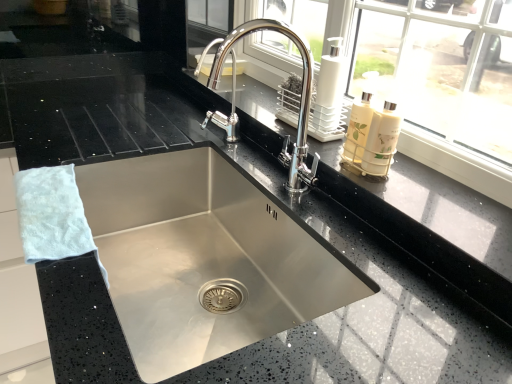
Find the location of a particular element. The height and width of the screenshot is (384, 512). white fluffy hand towel at left is located at coordinates (53, 216).

At what (x,y) coordinates should I click in order to perform the action: click on stainless steel sink at center. Please return your answer as a coordinate pair (x, y). This screenshot has width=512, height=384. Looking at the image, I should click on (206, 258).

Find the location of `white fluffy hand towel at left`. white fluffy hand towel at left is located at coordinates (53, 216).

Does point (307, 117) come closer to viewer compared to point (345, 151)?

No, it is not.

Is polished chrome faucet at center closer to the viewer compared to white glossy soap dispenser at upper right?

Yes, the depth of polished chrome faucet at center is less than that of white glossy soap dispenser at upper right.

From a real-world perspective, relative to white glossy soap dispenser at upper right, is polished chrome faucet at center vertically above or below?

polished chrome faucet at center is below white glossy soap dispenser at upper right.

Can you tell me how much polished chrome faucet at center and white glossy soap dispenser at upper right differ in facing direction?

The facing directions of polished chrome faucet at center and white glossy soap dispenser at upper right are 2.19 degrees apart.

Consider the image. Considering the sizes of objects polished chrome faucet at center and white fluffy hand towel at left in the image provided, who is taller, polished chrome faucet at center or white fluffy hand towel at left?

polished chrome faucet at center.

Is polished chrome faucet at center facing towards white fluffy hand towel at left?

Yes.

The height and width of the screenshot is (384, 512). I want to click on hand towel to the left of polished chrome faucet at center, so click(x=53, y=216).

Are polished chrome faucet at center and white fluffy hand towel at left far apart?

Actually, polished chrome faucet at center and white fluffy hand towel at left are a little close together.

From a real-world perspective, which is physically above, white glossy soap dispenser at upper right or polished chrome faucet at center?

white glossy soap dispenser at upper right is physically above.

Is white glossy soap dispenser at upper right turned away from polished chrome faucet at center?

No, polished chrome faucet at center is not at the back of white glossy soap dispenser at upper right.

Is point (361, 141) closer to viewer compared to point (216, 57)?

Yes, point (361, 141) is closer to viewer.

How many degrees apart are the facing directions of white glossy soap dispenser at upper right and polished chrome faucet at center?

2.19 degrees.

Which is in front, point (122, 272) or point (361, 114)?

The point (361, 114) is more forward.

Who is bigger, stainless steel sink at center or white glossy soap dispenser at upper right?

stainless steel sink at center is bigger.

Consider the image. Is white glossy soap dispenser at upper right completely or partially inside stainless steel sink at center?

No.

Can you confirm if stainless steel sink at center is taller than white glossy soap dispenser at upper right?

Indeed, stainless steel sink at center has a greater height compared to white glossy soap dispenser at upper right.

Considering their positions, is white fluffy hand towel at left located in front of or behind stainless steel sink at center?

white fluffy hand towel at left is behind stainless steel sink at center.

From the image's perspective, which is below, white fluffy hand towel at left or stainless steel sink at center?

stainless steel sink at center appears lower in the image.

Could you tell me if white fluffy hand towel at left is facing stainless steel sink at center?

Yes, white fluffy hand towel at left faces towards stainless steel sink at center.

This screenshot has height=384, width=512. Identify the location of sink lying below the white fluffy hand towel at left (from the image's perspective). (206, 258).

From a real-world perspective, does polished chrome faucet at center sit lower than stainless steel sink at center?

No.

How many degrees apart are the facing directions of polished chrome faucet at center and stainless steel sink at center?

They differ by 1.29 degrees in their facing directions.

Would you consider polished chrome faucet at center to be distant from stainless steel sink at center?

They are positioned close to each other.

Where is `sink on the left of the polished chrome faucet at center`? Image resolution: width=512 pixels, height=384 pixels. sink on the left of the polished chrome faucet at center is located at coordinates (206, 258).

From the image's perspective, which one is positioned higher, stainless steel sink at center or white fluffy hand towel at left?

white fluffy hand towel at left, from the image's perspective.

Can you confirm if stainless steel sink at center is taller than white fluffy hand towel at left?

Indeed, stainless steel sink at center has a greater height compared to white fluffy hand towel at left.

In the image, is stainless steel sink at center positioned in front of or behind white fluffy hand towel at left?

Visually, stainless steel sink at center is located in front of white fluffy hand towel at left.

Where is `sink that is under the white fluffy hand towel at left (from a real-world perspective)`? sink that is under the white fluffy hand towel at left (from a real-world perspective) is located at coordinates (206, 258).

Where is `tap that is under the white glossy soap dispenser at upper right (from a real-world perspective)`? The height and width of the screenshot is (384, 512). tap that is under the white glossy soap dispenser at upper right (from a real-world perspective) is located at coordinates (300, 100).

Find the location of `hand towel that appears in front of the polished chrome faucet at center`. hand towel that appears in front of the polished chrome faucet at center is located at coordinates (53, 216).

Consider the image. Looking at the image, which one is located closer to white glossy soap dispenser at upper right, white fluffy hand towel at left or stainless steel sink at center?

The object closer to white glossy soap dispenser at upper right is stainless steel sink at center.

Looking at this image, when comparing their distances from stainless steel sink at center, does white fluffy hand towel at left or white glossy soap dispenser at upper right seem further?

white glossy soap dispenser at upper right.

From the image, which object appears to be farther from stainless steel sink at center, polished chrome faucet at center or white fluffy hand towel at left?

white fluffy hand towel at left lies further to stainless steel sink at center than the other object.

Based on their spatial positions, is white glossy soap dispenser at upper right or white fluffy hand towel at left further from stainless steel sink at center?

white glossy soap dispenser at upper right.

Based on their spatial positions, is polished chrome faucet at center or white glossy soap dispenser at upper right further from white fluffy hand towel at left?

The object further to white fluffy hand towel at left is white glossy soap dispenser at upper right.

Based on their spatial positions, is white fluffy hand towel at left or polished chrome faucet at center further from white glossy soap dispenser at upper right?

white fluffy hand towel at left.

From the image, which object appears to be nearer to white fluffy hand towel at left, stainless steel sink at center or white glossy soap dispenser at upper right?

stainless steel sink at center.

Estimate the real-world distances between objects in this image. Which object is closer to stainless steel sink at center, white glossy soap dispenser at upper right or polished chrome faucet at center?

polished chrome faucet at center is closer to stainless steel sink at center.

At what (x,y) coordinates should I click in order to perform the action: click on hand towel between polished chrome faucet at center and stainless steel sink at center vertically. Please return your answer as a coordinate pair (x, y). The height and width of the screenshot is (384, 512). Looking at the image, I should click on (53, 216).

You are a GUI agent. You are given a task and a screenshot of the screen. Output one action in this format:
    pyautogui.click(x=<x>, y=<y>)
    Task: Click on the tap between white fluffy hand towel at left and white glossy soap dispenser at upper right from left to right
    The height and width of the screenshot is (384, 512).
    Given the screenshot: What is the action you would take?
    pyautogui.click(x=300, y=100)

You are a GUI agent. You are given a task and a screenshot of the screen. Output one action in this format:
    pyautogui.click(x=<x>, y=<y>)
    Task: Click on the tap situated between stainless steel sink at center and white glossy soap dispenser at upper right from left to right
    This screenshot has width=512, height=384.
    Given the screenshot: What is the action you would take?
    pyautogui.click(x=300, y=100)

The width and height of the screenshot is (512, 384). I want to click on sink located between white fluffy hand towel at left and white glossy soap dispenser at upper right in the left-right direction, so click(x=206, y=258).